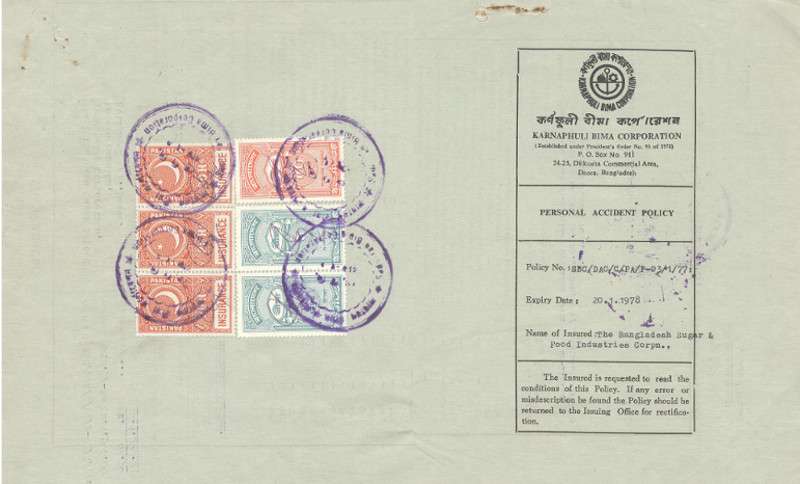
Image resolution: width=800 pixels, height=484 pixels. Find the location of `boxes`. boxes is located at coordinates (190, 169), (178, 222), (165, 307), (270, 305), (270, 246), (272, 187).